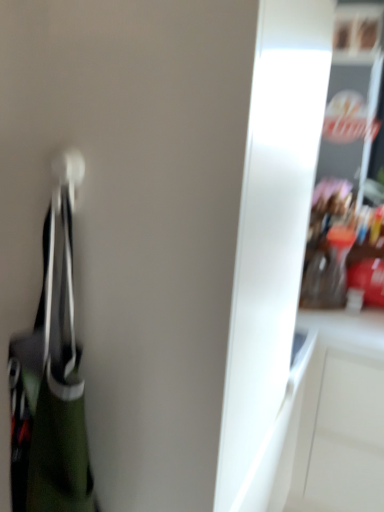
Question: Visually, is white glossy cabinet at right positioned to the left or to the right of green fabric handbag at left?

Choices:
 (A) left
 (B) right

Answer: (B)

Question: From the image's perspective, relative to green fabric handbag at left, is white glossy cabinet at right above or below?

Choices:
 (A) above
 (B) below

Answer: (B)

Question: Based on their sizes in the image, would you say white glossy cabinet at right is bigger or smaller than green fabric handbag at left?

Choices:
 (A) big
 (B) small

Answer: (A)

Question: Is point (43, 379) positioned closer to the camera than point (294, 411)?

Choices:
 (A) closer
 (B) farther

Answer: (A)

Question: Visually, is green fabric handbag at left positioned to the left or to the right of white glossy cabinet at right?

Choices:
 (A) right
 (B) left

Answer: (B)

Question: Considering the positions of green fabric handbag at left and white glossy cabinet at right in the image, is green fabric handbag at left wider or thinner than white glossy cabinet at right?

Choices:
 (A) thin
 (B) wide

Answer: (A)

Question: From the image's perspective, relative to white glossy cabinet at right, is green fabric handbag at left above or below?

Choices:
 (A) below
 (B) above

Answer: (B)